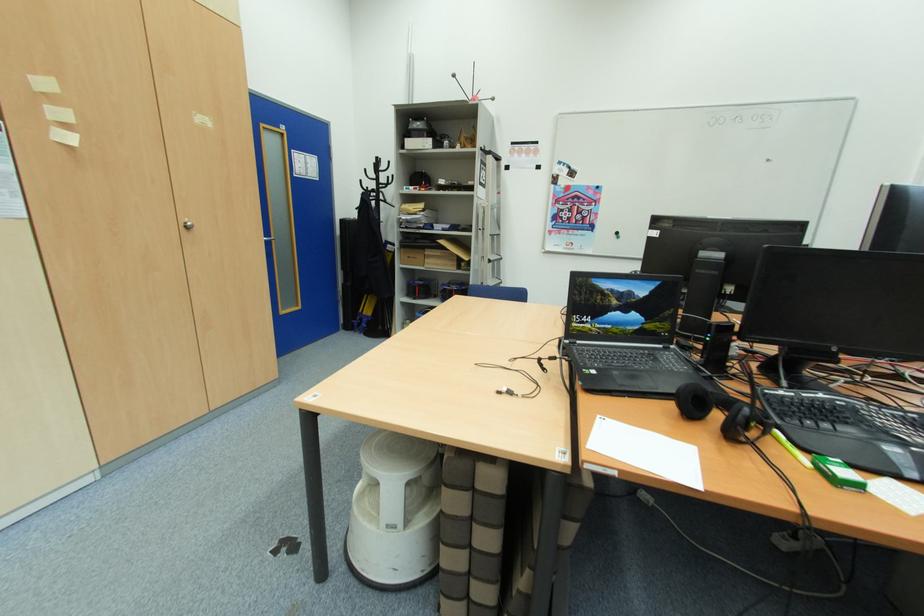
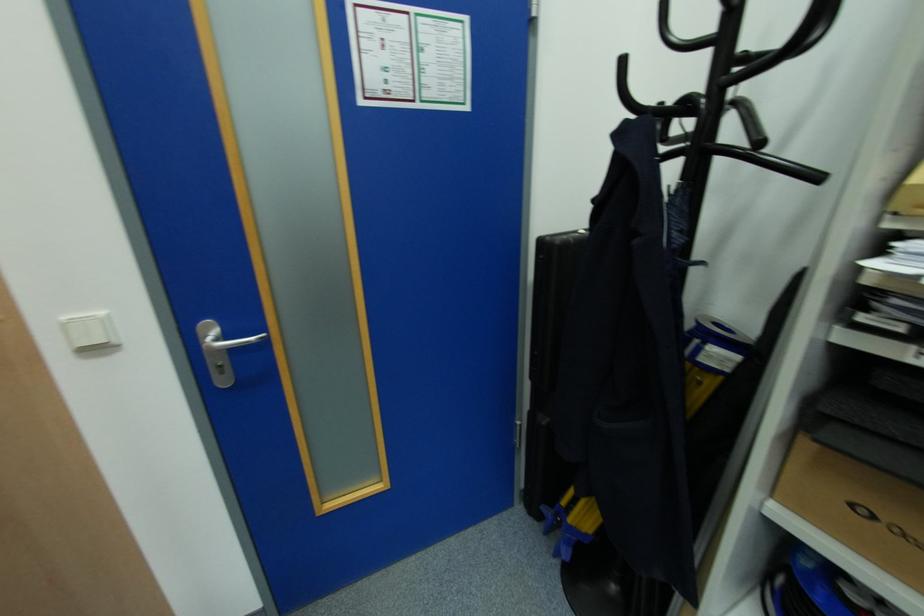
Find the pixel in the second image that matches the point at 353,285 in the first image.

(548, 421)